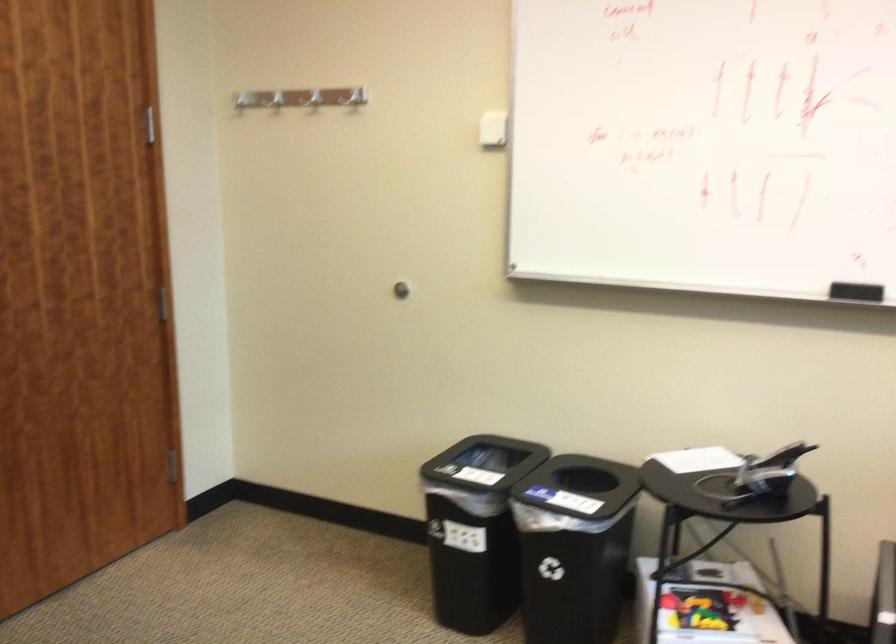
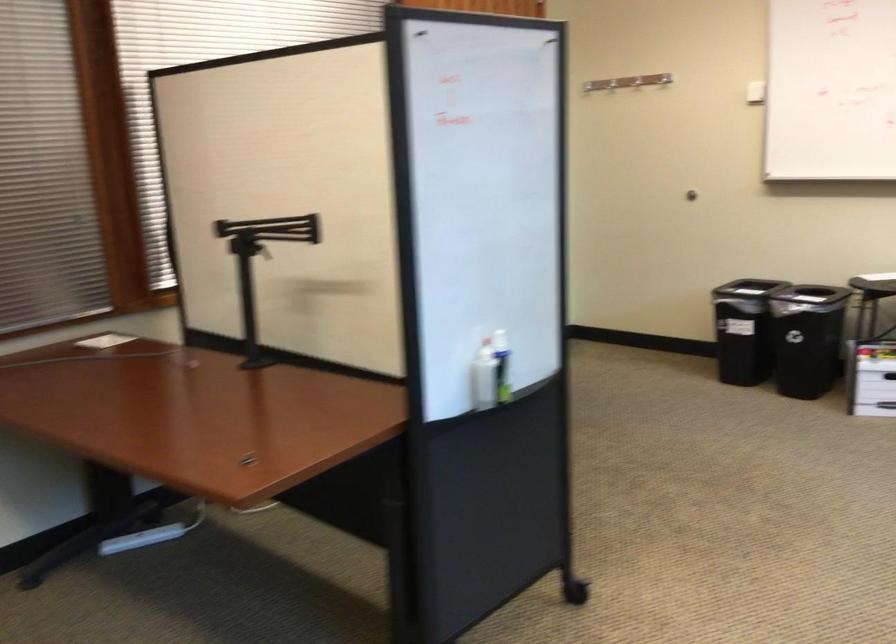
Where in the second image is the point corresponding to [434,113] from the first image?

(636, 82)